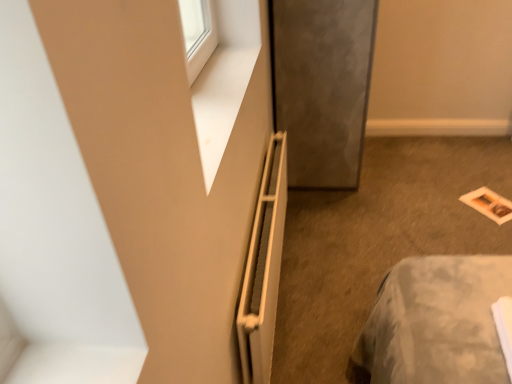
I want to click on vacant space in matte paper magazine at lower right (from a real-world perspective), so click(x=482, y=200).